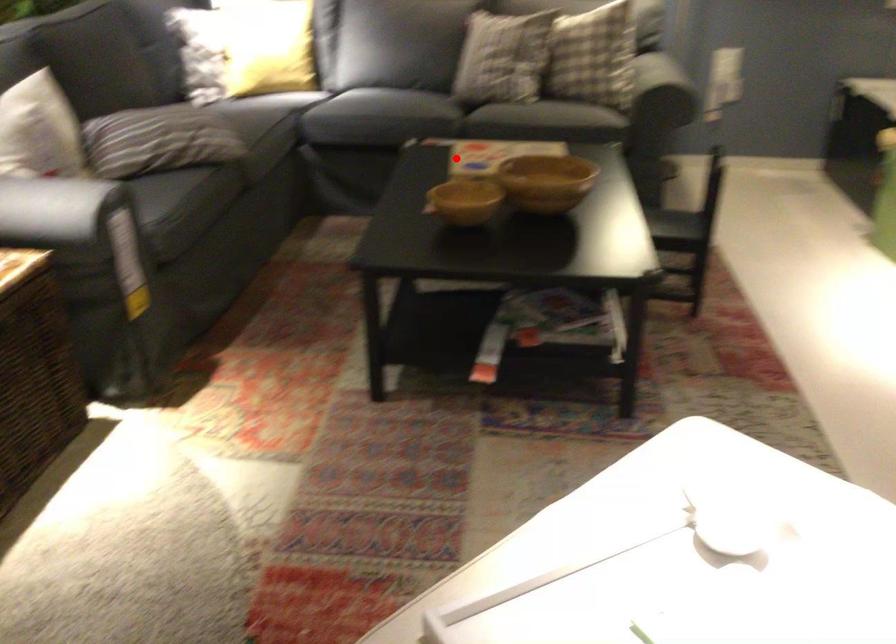
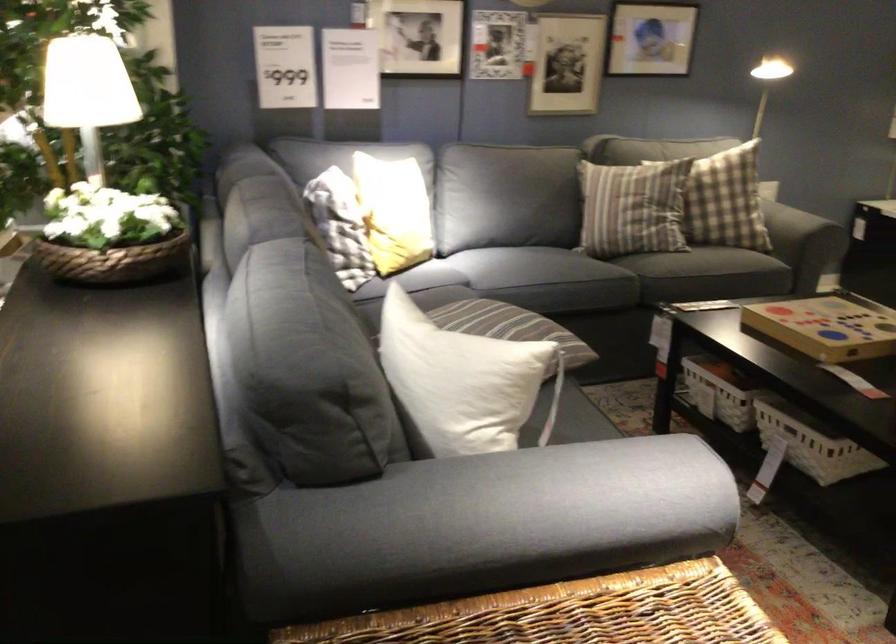
Question: I am providing you with two images of the same scene from different viewpoints. Image1 has a red point marked. In image2, the corresponding 3D location appears at what relative position? Reply with the corresponding letter.

Choices:
 (A) Closer
 (B) Farther

Answer: (A)